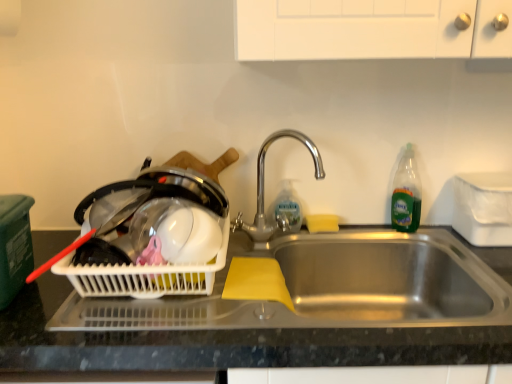
Question: In terms of size, does clear plastic bottle at sink, which is the second bottle from right to left, appear bigger or smaller than polished metal faucet at center?

Choices:
 (A) big
 (B) small

Answer: (B)

Question: Is clear plastic bottle at sink, which ranks as the first bottle in left-to-right order, situated inside polished metal faucet at center or outside?

Choices:
 (A) outside
 (B) inside

Answer: (B)

Question: Which is nearer to the yellow sponge at sink?

Choices:
 (A) stainless steel sink at center
 (B) clear plastic bottle at sink, which ranks as the first bottle in left-to-right order
 (C) green translucent bottle at right, the 1th bottle when ordered from right to left
 (D) polished metal faucet at center
 (E) white plastic basket at left

Answer: (B)

Question: Which is nearer to the clear plastic bottle at sink, which is the second bottle from right to left?

Choices:
 (A) white plastic container at right
 (B) stainless steel sink at center
 (C) polished metal faucet at center
 (D) yellow sponge at sink
 (E) green translucent bottle at right, the 1th bottle when ordered from right to left

Answer: (C)